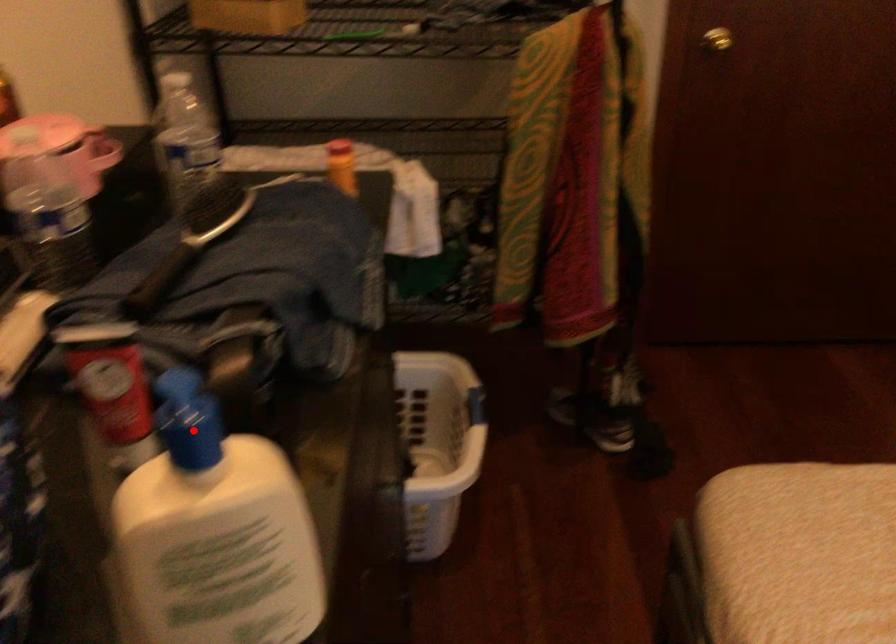
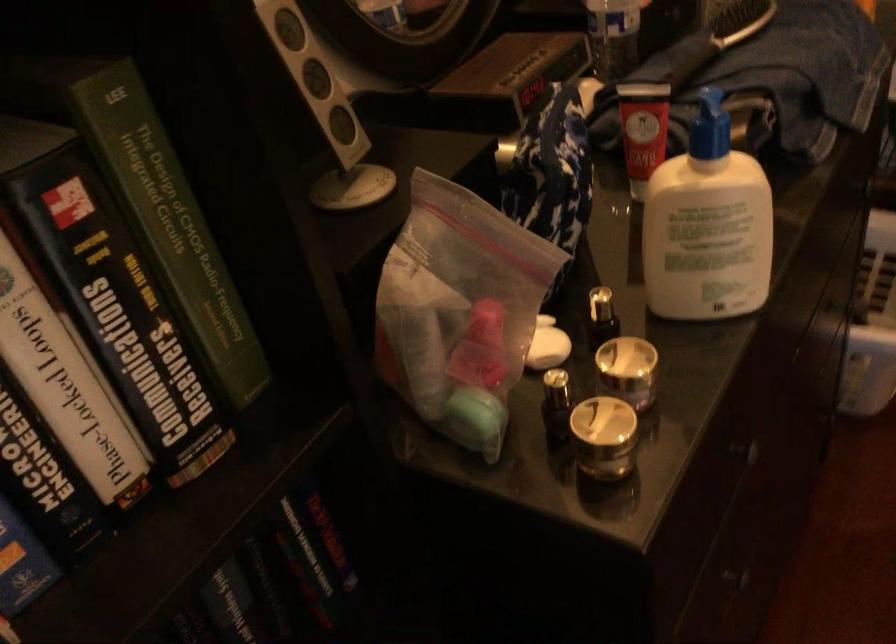
Question: I am providing you with two images of the same scene from different viewpoints. In image1, a red point is highlighted. Considering the same 3D point in image2, which of the following is correct?

Choices:
 (A) It is closer
 (B) It is farther

Answer: (B)